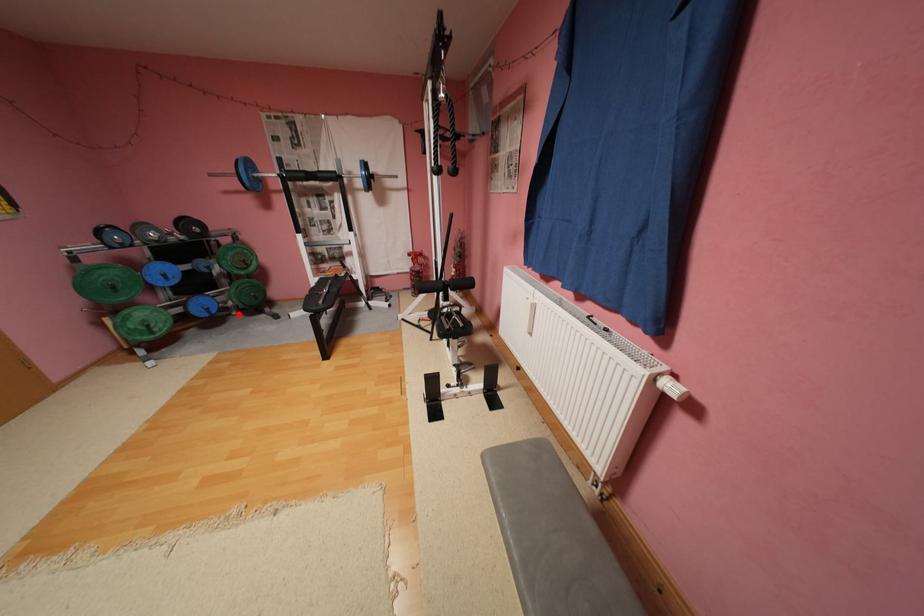
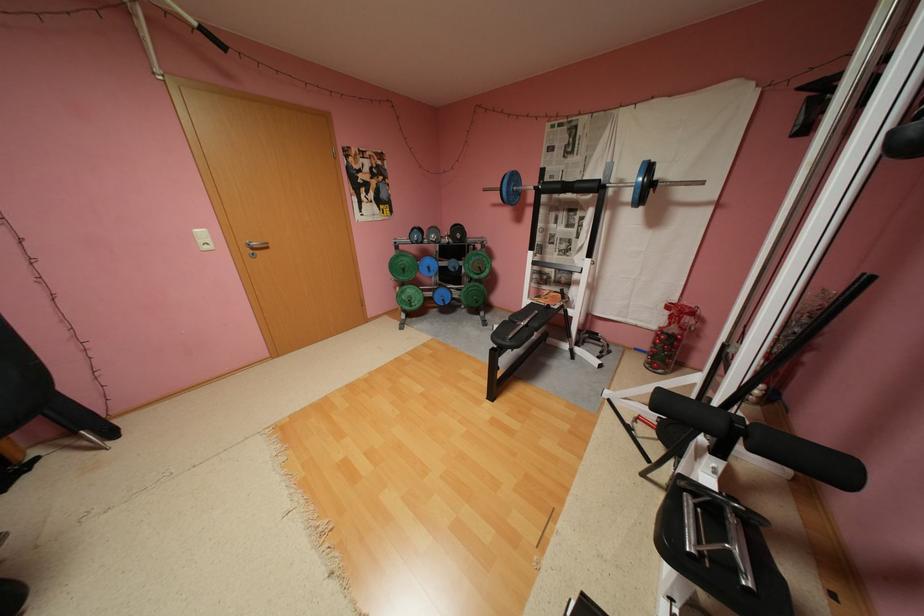
The point at the highlighted location is marked in the first image. Where is the corresponding point in the second image?

(468, 306)